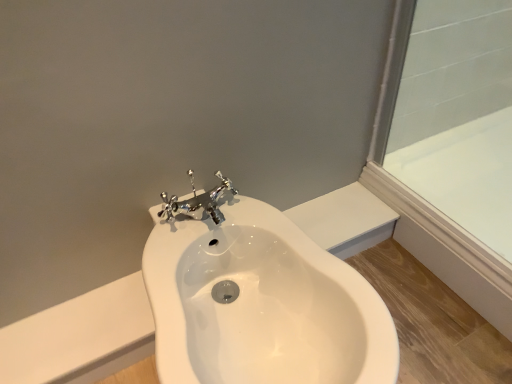
Find the location of a particular element. Image resolution: width=512 pixels, height=384 pixels. white glossy bathtub at upper right is located at coordinates (465, 176).

What do you see at coordinates (465, 176) in the screenshot? The height and width of the screenshot is (384, 512). I see `white glossy bathtub at upper right` at bounding box center [465, 176].

In order to face white glossy bathtub at upper right, should I rotate leftwards or rightwards?

To align with it, rotate right about 31.151°.

What is the approximate width of white glossy bathtub at upper right?

The width of white glossy bathtub at upper right is 20.28 inches.

This screenshot has height=384, width=512. What do you see at coordinates (262, 305) in the screenshot?
I see `white glossy sink at center` at bounding box center [262, 305].

Where is `white glossy sink at center`? Image resolution: width=512 pixels, height=384 pixels. white glossy sink at center is located at coordinates (262, 305).

Locate an element on the screen. The height and width of the screenshot is (384, 512). white glossy bathtub at upper right is located at coordinates (465, 176).

Considering the relative positions of white glossy bathtub at upper right and white glossy sink at center in the image provided, is white glossy bathtub at upper right to the right of white glossy sink at center from the viewer's perspective?

Indeed, white glossy bathtub at upper right is positioned on the right side of white glossy sink at center.

Is white glossy bathtub at upper right positioned in front of white glossy sink at center?

No, white glossy bathtub at upper right is further to the viewer.

Does point (389, 167) lie behind point (198, 346)?

Yes, point (389, 167) is farther from viewer.

From the image's perspective, which one is positioned higher, white glossy bathtub at upper right or white glossy sink at center?

white glossy bathtub at upper right, from the image's perspective.

From a real-world perspective, which is physically below, white glossy bathtub at upper right or white glossy sink at center?

From a 3D spatial view, white glossy bathtub at upper right is below.

From the picture: Is white glossy bathtub at upper right wider or thinner than white glossy sink at center?

In the image, white glossy bathtub at upper right appears to be more narrow than white glossy sink at center.

Considering the sizes of objects white glossy bathtub at upper right and white glossy sink at center in the image provided, who is taller, white glossy bathtub at upper right or white glossy sink at center?

white glossy sink at center is taller.

Which of these two, white glossy bathtub at upper right or white glossy sink at center, is bigger?

white glossy sink at center is bigger.

Based on the photo, is white glossy sink at center surrounded by white glossy bathtub at upper right?

No, white glossy sink at center is located outside of white glossy bathtub at upper right.

Is white glossy bathtub at upper right far from white glossy sink at center?

white glossy bathtub at upper right is near white glossy sink at center, not far away.

Is white glossy bathtub at upper right facing towards white glossy sink at center?

No, white glossy bathtub at upper right does not turn towards white glossy sink at center.

Measure the distance from white glossy bathtub at upper right to white glossy sink at center.

They are 28.59 inches apart.

You are a GUI agent. You are given a task and a screenshot of the screen. Output one action in this format:
    pyautogui.click(x=<x>, y=<y>)
    Task: Click on the sink below the white glossy bathtub at upper right (from the image's perspective)
    The image size is (512, 384).
    Given the screenshot: What is the action you would take?
    tap(262, 305)

Considering the positions of objects white glossy sink at center and white glossy bathtub at upper right in the image provided, who is more to the left, white glossy sink at center or white glossy bathtub at upper right?

From the viewer's perspective, white glossy sink at center appears more on the left side.

Is white glossy sink at center behind white glossy bathtub at upper right?

That is False.

Is point (157, 261) positioned in front of point (501, 140)?

Yes.

From the image's perspective, is white glossy sink at center on white glossy bathtub at upper right?

Actually, white glossy sink at center appears below white glossy bathtub at upper right in the image.

From a real-world perspective, which is physically above, white glossy sink at center or white glossy bathtub at upper right?

From a 3D spatial view, white glossy sink at center is above.

Does white glossy sink at center have a lesser width compared to white glossy bathtub at upper right?

No, white glossy sink at center is not thinner than white glossy bathtub at upper right.

In terms of height, does white glossy sink at center look taller or shorter compared to white glossy bathtub at upper right?

In the image, white glossy sink at center appears to be taller than white glossy bathtub at upper right.

Is white glossy sink at center smaller than white glossy bathtub at upper right?

Incorrect, white glossy sink at center is not smaller in size than white glossy bathtub at upper right.

Is white glossy bathtub at upper right located within white glossy sink at center?

Definitely not — white glossy bathtub at upper right is not inside white glossy sink at center.

Is white glossy sink at center with white glossy bathtub at upper right?

white glossy sink at center and white glossy bathtub at upper right are clearly separated.

Is white glossy sink at center looking in the opposite direction of white glossy bathtub at upper right?

white glossy sink at center is not turned away from white glossy bathtub at upper right.

Measure the distance between white glossy sink at center and white glossy bathtub at upper right.

They are 28.59 inches apart.

Find the location of a particular element. This screenshot has height=384, width=512. bath that appears behind the white glossy sink at center is located at coordinates (465, 176).

This screenshot has width=512, height=384. I want to click on bath below the white glossy sink at center (from a real-world perspective), so click(x=465, y=176).

Locate an element on the screen. This screenshot has height=384, width=512. sink in front of the white glossy bathtub at upper right is located at coordinates (262, 305).